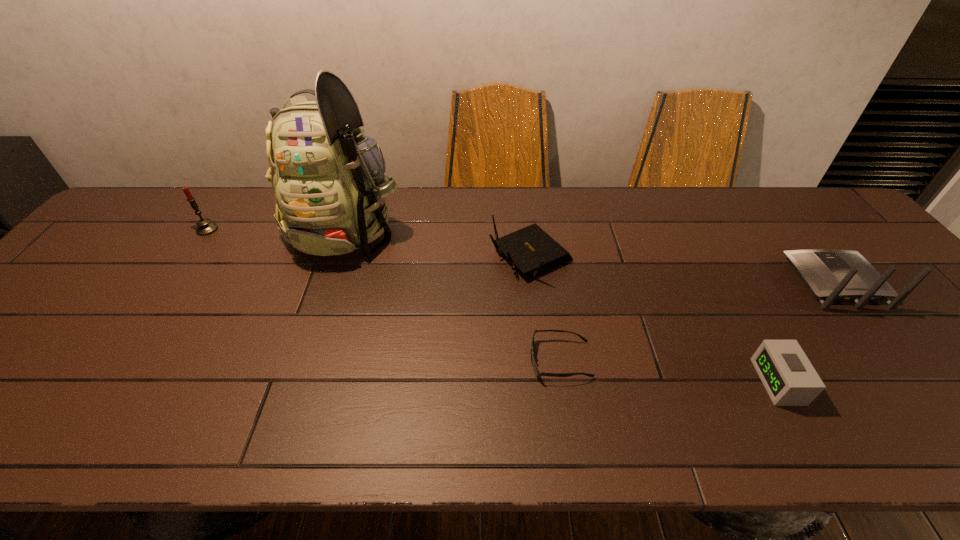
In the image, there is a desktop. In order to click on blank space at the far left corner in this screenshot , I will do `click(155, 218)`.

Locate an element on the screen. Image resolution: width=960 pixels, height=540 pixels. free spot between the taller router and the alarm clock is located at coordinates (807, 332).

The image size is (960, 540). Identify the location of vacant space that is in between the shorter router and the fifth tallest object. (655, 319).

Identify the location of free space between the second shortest object and the backpack. (564, 303).

The image size is (960, 540). In order to click on free spot between the fourth tallest object and the rightmost object in this screenshot , I will do `click(684, 269)`.

Identify the location of unoccupied area between the candle and the sunglasses. (384, 295).

The height and width of the screenshot is (540, 960). Find the location of `vacant space that is in between the tallest object and the sunglasses`. vacant space that is in between the tallest object and the sunglasses is located at coordinates (454, 292).

At what (x,y) coordinates should I click in order to perform the action: click on vacant area that lies between the backpack and the leftmost object. Please return your answer as a coordinate pair (x, y). This screenshot has height=540, width=960. Looking at the image, I should click on (277, 227).

The height and width of the screenshot is (540, 960). In order to click on free space that is in between the tallest object and the third shortest object in this screenshot , I will do `click(440, 241)`.

Locate an element on the screen. The image size is (960, 540). unoccupied position between the left router and the tallest object is located at coordinates (440, 241).